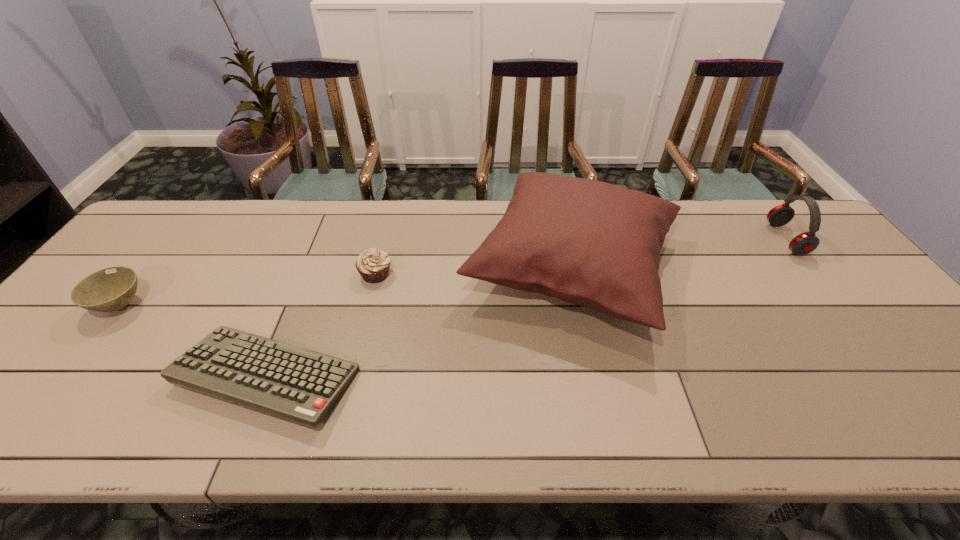
The image size is (960, 540). Identify the location of the fourth object from left to right. (594, 244).

Identify the location of the tallest object. (594, 244).

Where is `the second tallest object`? the second tallest object is located at coordinates 804,243.

Where is `earphone`? The height and width of the screenshot is (540, 960). earphone is located at coordinates (804, 243).

This screenshot has width=960, height=540. In order to click on the leftmost object in this screenshot , I will do `click(110, 289)`.

Locate an element on the screen. muffin is located at coordinates (373, 265).

You are a GUI agent. You are given a task and a screenshot of the screen. Output one action in this format:
    pyautogui.click(x=<x>, y=<y>)
    Task: Click on the shortest object
    The height and width of the screenshot is (540, 960).
    Given the screenshot: What is the action you would take?
    pyautogui.click(x=300, y=385)

The width and height of the screenshot is (960, 540). I want to click on free space located 0.070m on the front of the second object from right to left, so click(x=599, y=386).

Locate an element on the screen. The image size is (960, 540). vacant space positioned on the ear cups of the earphone is located at coordinates (645, 239).

In order to click on vacant space situated 0.120m on the ear cups of the earphone in this screenshot , I will do `click(734, 239)`.